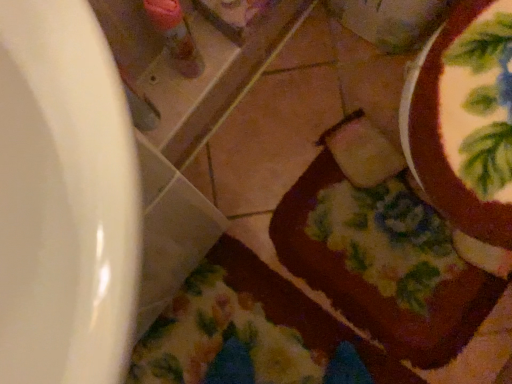
This screenshot has width=512, height=384. What do you see at coordinates (224, 338) in the screenshot?
I see `floral fabric blanket at lower center` at bounding box center [224, 338].

The image size is (512, 384). I want to click on floral fabric blanket at lower center, so click(224, 338).

What do you see at coordinates (383, 262) in the screenshot? I see `chocolate frosted cake at lower right` at bounding box center [383, 262].

Identify the location of chocolate frosted cake at lower right. The image size is (512, 384). (383, 262).

Where is `floral fabric blanket at lower center`? The height and width of the screenshot is (384, 512). floral fabric blanket at lower center is located at coordinates (224, 338).

Considering the relative positions of floral fabric blanket at lower center and chocolate frosted cake at lower right in the image provided, is floral fabric blanket at lower center to the left of chocolate frosted cake at lower right from the viewer's perspective?

Yes, floral fabric blanket at lower center is to the left of chocolate frosted cake at lower right.

Does floral fabric blanket at lower center lie in front of chocolate frosted cake at lower right?

Yes, floral fabric blanket at lower center is closer to the camera.

Does point (199, 377) appear closer or farther from the camera than point (370, 279)?

Clearly, point (199, 377) is closer to the camera than point (370, 279).

From the image's perspective, is floral fabric blanket at lower center located above or below chocolate frosted cake at lower right?

Based on their image positions, floral fabric blanket at lower center is located beneath chocolate frosted cake at lower right.

From a real-world perspective, is floral fabric blanket at lower center above or below chocolate frosted cake at lower right?

Clearly, from a real-world perspective, floral fabric blanket at lower center is below chocolate frosted cake at lower right.

Considering the relative sizes of floral fabric blanket at lower center and chocolate frosted cake at lower right in the image provided, is floral fabric blanket at lower center wider than chocolate frosted cake at lower right?

No.

Looking at this image, which of these two, floral fabric blanket at lower center or chocolate frosted cake at lower right, stands shorter?

floral fabric blanket at lower center is shorter.

Based on their sizes in the image, would you say floral fabric blanket at lower center is bigger or smaller than chocolate frosted cake at lower right?

In the image, floral fabric blanket at lower center appears to be smaller than chocolate frosted cake at lower right.

Is floral fabric blanket at lower center inside the boundaries of chocolate frosted cake at lower right, or outside?

floral fabric blanket at lower center is not enclosed by chocolate frosted cake at lower right.

From the picture: Are floral fabric blanket at lower center and chocolate frosted cake at lower right beside each other?

No, floral fabric blanket at lower center is not beside chocolate frosted cake at lower right.

Consider the image. Does floral fabric blanket at lower center turn towards chocolate frosted cake at lower right?

No, floral fabric blanket at lower center is not oriented towards chocolate frosted cake at lower right.

How distant is floral fabric blanket at lower center from chocolate frosted cake at lower right?

floral fabric blanket at lower center and chocolate frosted cake at lower right are 8.88 inches apart.

What are the coordinates of `blanket in front of the chocolate frosted cake at lower right` in the screenshot? It's located at (224, 338).

Consider the image. Does chocolate frosted cake at lower right appear on the right side of floral fabric blanket at lower center?

Indeed, chocolate frosted cake at lower right is positioned on the right side of floral fabric blanket at lower center.

Considering the relative positions of chocolate frosted cake at lower right and floral fabric blanket at lower center in the image provided, is chocolate frosted cake at lower right in front of floral fabric blanket at lower center?

No.

Does point (346, 299) come closer to viewer compared to point (302, 382)?

No, it is not.

From the image's perspective, which object appears higher, chocolate frosted cake at lower right or floral fabric blanket at lower center?

chocolate frosted cake at lower right, from the image's perspective.

From a real-world perspective, is chocolate frosted cake at lower right physically above floral fabric blanket at lower center?

Yes, from a real-world perspective, chocolate frosted cake at lower right is above floral fabric blanket at lower center.

Is chocolate frosted cake at lower right wider than floral fabric blanket at lower center?

Indeed, chocolate frosted cake at lower right has a greater width compared to floral fabric blanket at lower center.

Who is shorter, chocolate frosted cake at lower right or floral fabric blanket at lower center?

With less height is floral fabric blanket at lower center.

Between chocolate frosted cake at lower right and floral fabric blanket at lower center, which one has smaller size?

floral fabric blanket at lower center is smaller.

Would you say chocolate frosted cake at lower right is inside or outside floral fabric blanket at lower center?

chocolate frosted cake at lower right lies outside floral fabric blanket at lower center.

Is chocolate frosted cake at lower right not close to floral fabric blanket at lower center?

That's not correct — chocolate frosted cake at lower right is a little close to floral fabric blanket at lower center.

Is chocolate frosted cake at lower right facing towards floral fabric blanket at lower center?

Yes, chocolate frosted cake at lower right faces towards floral fabric blanket at lower center.

The height and width of the screenshot is (384, 512). Identify the location of chocolate cake located on the right of floral fabric blanket at lower center. (383, 262).

Locate an element on the screen. chocolate cake that is on the right side of floral fabric blanket at lower center is located at coordinates (383, 262).

The height and width of the screenshot is (384, 512). I want to click on chocolate cake located behind the floral fabric blanket at lower center, so (383, 262).